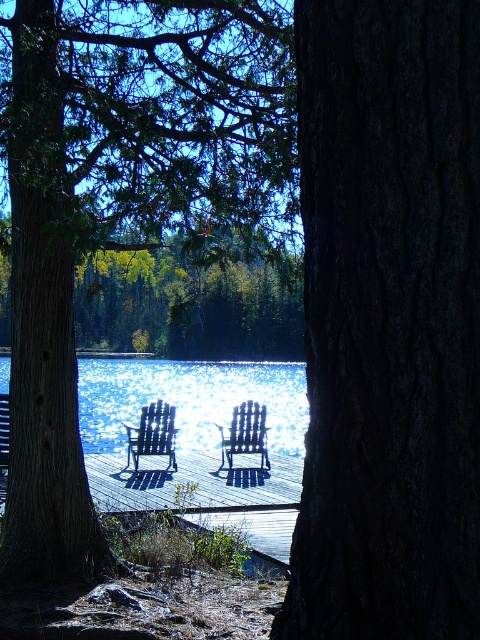
You are standing at the center of the image. Which direction should you move to get closer to the green matte tree at center?

The green matte tree at center is already at the center of the image, so you don not need to move in any direction to get closer.

You are planning to sit on the blue plastic beach chair at center but want to ensure it is not obstructed by the green matte tree at center. Is the tree blocking the chair?

The green matte tree at center is positioned over blue plastic beach chair at center, so the tree is blocking the chair.

You are standing at the lakeside and want to take a photo of the glistening silver water at center. If your camera can focus on objects up to 15 meters away, will it be able to capture the water clearly?

The glistening silver water at center is 17.05 meters from the camera, which is beyond the camera focus range of 15 meters. Therefore, the camera cannot capture the water clearly.